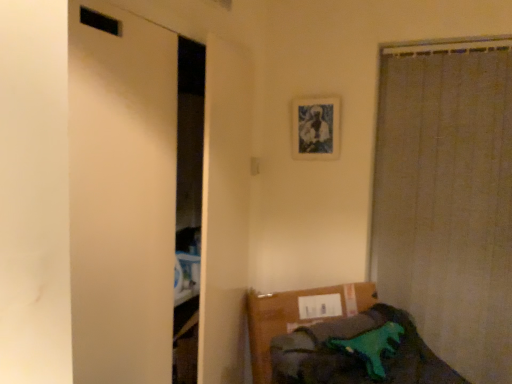
Question: Considering the relative sizes of beige textured curtain at right and blue textured fabric picture frame at upper center in the image provided, is beige textured curtain at right thinner than blue textured fabric picture frame at upper center?

Choices:
 (A) yes
 (B) no

Answer: (B)

Question: Can blue textured fabric picture frame at upper center be found inside beige textured curtain at right?

Choices:
 (A) no
 (B) yes

Answer: (A)

Question: Considering the relative positions of beige textured curtain at right and blue textured fabric picture frame at upper center in the image provided, is beige textured curtain at right to the right of blue textured fabric picture frame at upper center from the viewer's perspective?

Choices:
 (A) yes
 (B) no

Answer: (A)

Question: Is beige textured curtain at right shorter than blue textured fabric picture frame at upper center?

Choices:
 (A) no
 (B) yes

Answer: (A)

Question: From the image's perspective, would you say beige textured curtain at right is shown under blue textured fabric picture frame at upper center?

Choices:
 (A) yes
 (B) no

Answer: (A)

Question: Based on their positions, is beige textured curtain at right located to the left or right of blue textured fabric picture frame at upper center?

Choices:
 (A) left
 (B) right

Answer: (B)

Question: Is beige textured curtain at right spatially inside blue textured fabric picture frame at upper center, or outside of it?

Choices:
 (A) inside
 (B) outside

Answer: (B)

Question: From the image's perspective, is beige textured curtain at right positioned above or below blue textured fabric picture frame at upper center?

Choices:
 (A) below
 (B) above

Answer: (A)

Question: Is beige textured curtain at right taller or shorter than blue textured fabric picture frame at upper center?

Choices:
 (A) short
 (B) tall

Answer: (B)

Question: From the image's perspective, is green plastic toy dinosaur at lower right positioned above or below blue textured fabric picture frame at upper center?

Choices:
 (A) above
 (B) below

Answer: (B)

Question: From their relative heights in the image, would you say green plastic toy dinosaur at lower right is taller or shorter than blue textured fabric picture frame at upper center?

Choices:
 (A) short
 (B) tall

Answer: (B)

Question: Considering their positions, is green plastic toy dinosaur at lower right located in front of or behind blue textured fabric picture frame at upper center?

Choices:
 (A) behind
 (B) front

Answer: (B)

Question: From a real-world perspective, relative to blue textured fabric picture frame at upper center, is green plastic toy dinosaur at lower right vertically above or below?

Choices:
 (A) below
 (B) above

Answer: (A)

Question: Do you think beige textured curtain at right is within green plastic toy dinosaur at lower right, or outside of it?

Choices:
 (A) outside
 (B) inside

Answer: (A)

Question: Is point (387, 182) positioned closer to the camera than point (337, 307)?

Choices:
 (A) closer
 (B) farther

Answer: (B)